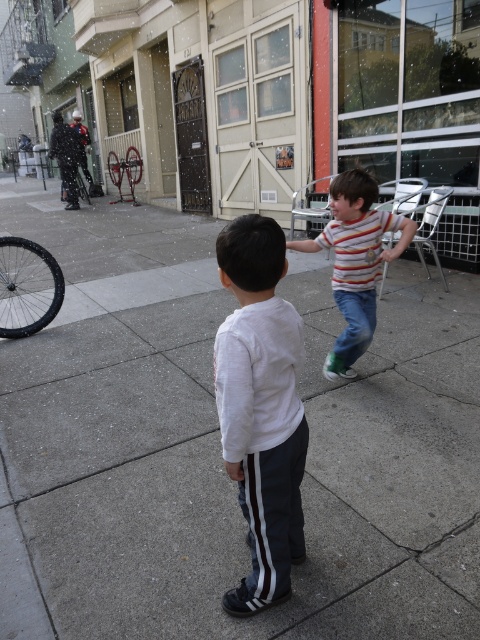
Is point (176, 365) positioned behind point (223, 275)?

Yes, point (176, 365) is farther from viewer.

Does gray concrete pavement at center appear on the right side of white matte shirt at center?

In fact, gray concrete pavement at center is to the left of white matte shirt at center.

The width and height of the screenshot is (480, 640). In order to click on gray concrete pavement at center in this screenshot , I will do `click(218, 445)`.

Between white matte shirt at center and striped cotton shirt at center, which one has less height?

Standing shorter between the two is striped cotton shirt at center.

Can you confirm if white matte shirt at center is positioned to the right of striped cotton shirt at center?

No, white matte shirt at center is not to the right of striped cotton shirt at center.

At what (x,y) coordinates should I click in order to perform the action: click on white matte shirt at center. Please return your answer as a coordinate pair (x, y). Looking at the image, I should click on (261, 406).

Is the position of striped cotton shirt at center less distant than that of black rubber tire at left?

Yes, striped cotton shirt at center is closer to the viewer.

Which is below, striped cotton shirt at center or black rubber tire at left?

Positioned lower is striped cotton shirt at center.

Locate an element on the screen. The height and width of the screenshot is (640, 480). striped cotton shirt at center is located at coordinates pyautogui.click(x=356, y=260).

Where is `striped cotton shirt at center`? striped cotton shirt at center is located at coordinates (356, 260).